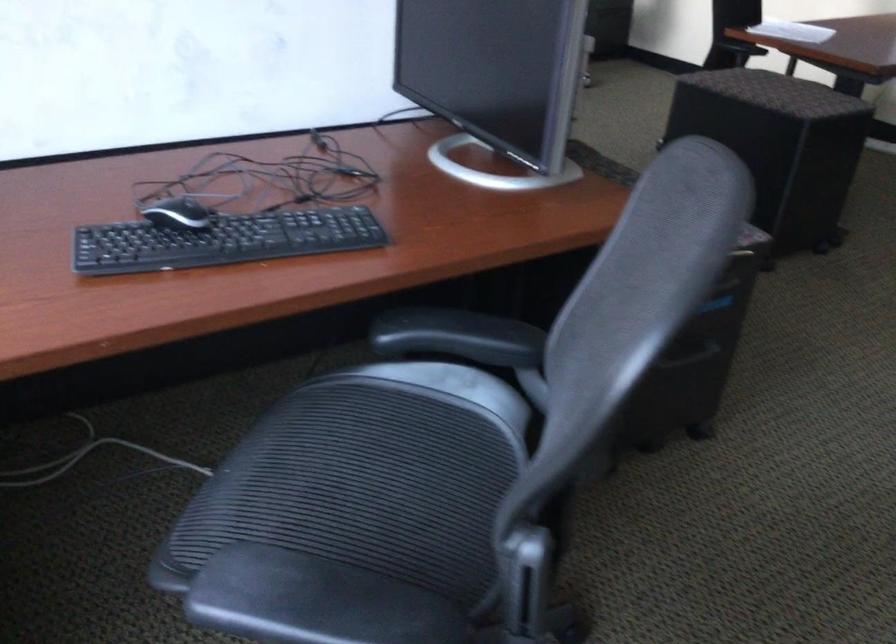
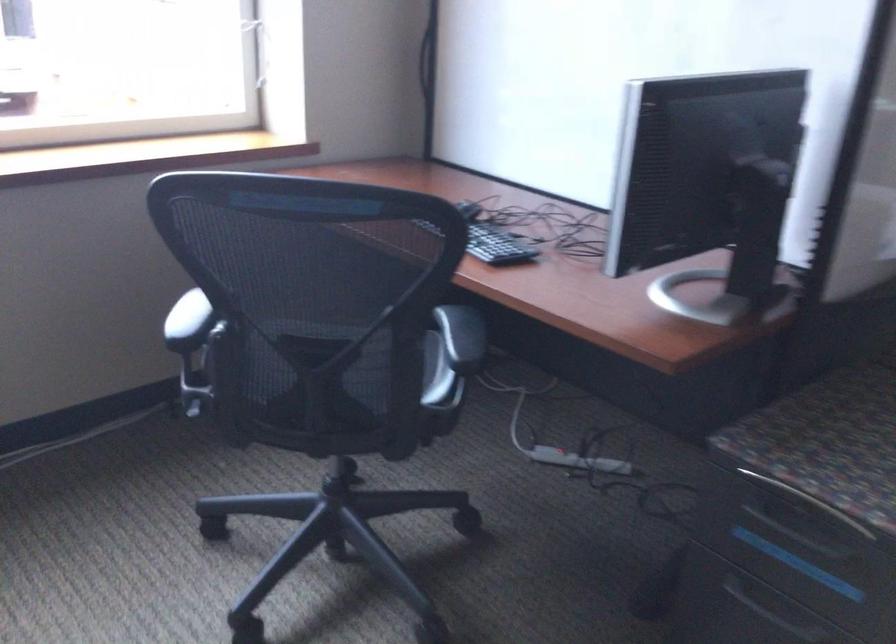
Question: I am providing you with two images of the same scene from different viewpoints. Which of the following objects are not visible in image2?

Choices:
 (A) black chair armrest
 (B) chair sitting surface
 (C) recessed drawer handle
 (D) black eyeglasses

Answer: (B)